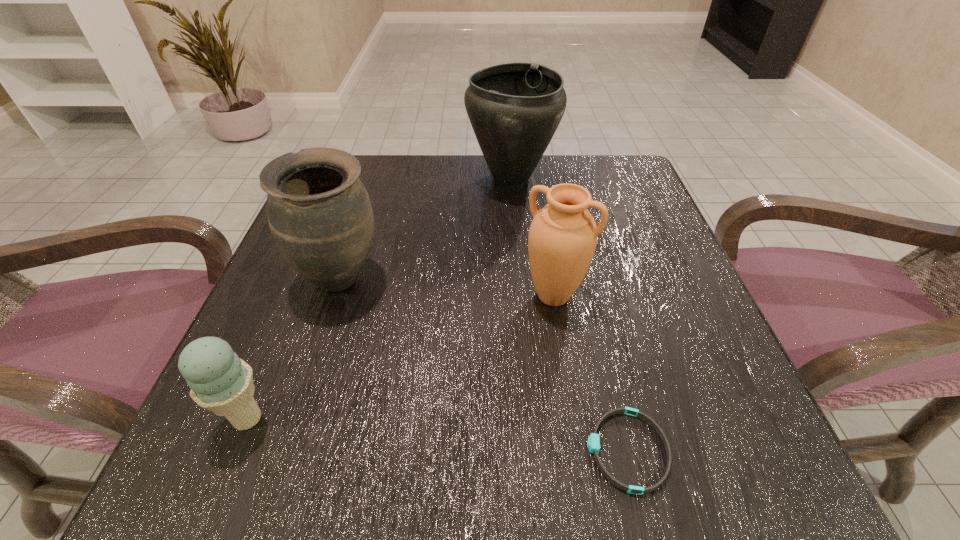
Locate an element on the screen. The image size is (960, 540). vacant area that lies between the leftmost urn and the farthest object is located at coordinates (426, 228).

Locate an element on the screen. This screenshot has height=540, width=960. empty space that is in between the shortest object and the second shortest object is located at coordinates (438, 435).

The width and height of the screenshot is (960, 540). I want to click on object that ranks as the third closest to the leftmost urn, so click(563, 235).

Find the location of `object that is the fourth closest one to the farthest object`. object that is the fourth closest one to the farthest object is located at coordinates (221, 382).

Select which urn is the closest to the wristband. Please provide its 2D coordinates. Your answer should be formatted as a tuple, i.e. [(x, y)], where the tuple contains the x and y coordinates of a point satisfying the conditions above.

[(563, 235)]

I want to click on urn identified as the second closest to the wristband, so click(319, 212).